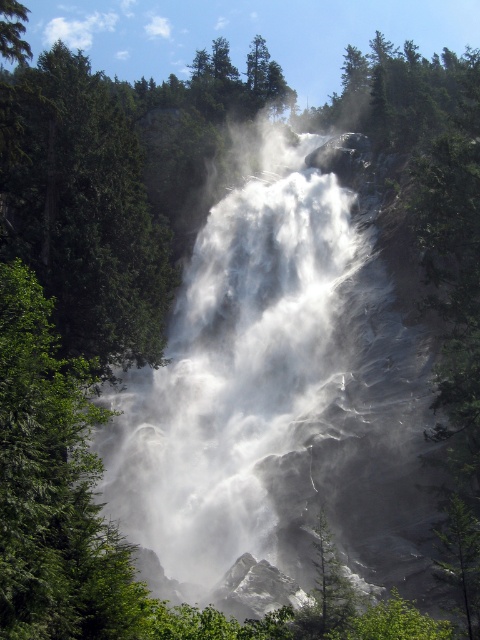
Based on the scene description, if you were standing at point (54, 486), which object would you be closest to?

You would be closest to the green leafy tree at left, as the point (54, 486) is where it is located.

You are a hiker trying to estimate the sizes of the trees in the scene. Which tree, the green leafy tree at left or the green matte tree at center, is bigger in size?

The green leafy tree at left is larger in size compared to the green matte tree at center.